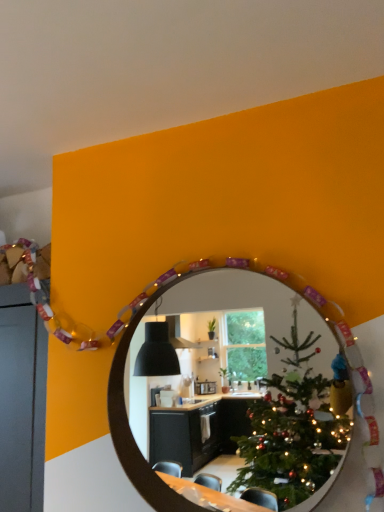
What do you see at coordinates (243, 396) in the screenshot?
I see `wooden mirror at center` at bounding box center [243, 396].

Where is `wooden mirror at center`? The width and height of the screenshot is (384, 512). wooden mirror at center is located at coordinates click(x=243, y=396).

Image resolution: width=384 pixels, height=512 pixels. Identify the location of wooden mirror at center. (243, 396).